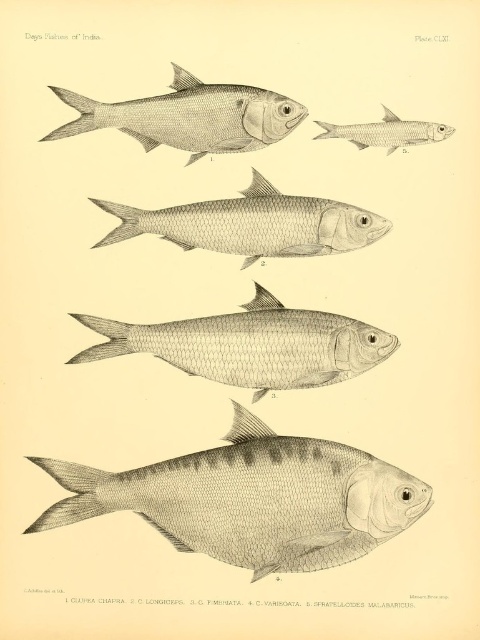
Consider the image. You are an ichthyologist examining the illustration. You need to determine which fish is taller between the grayish silver fish at upper center and the gray metallic fish at upper center. Based on the illustration, which one is taller?

The grayish silver fish at upper center is taller than the gray metallic fish at upper center according to the illustration.

In the illustration from the scientific publication, you see two fish at the upper center labeled as grayish silver fish at upper center and gray metallic fish at upper center. Which one is located to the left?

The grayish silver fish at upper center is positioned on the left side of the gray metallic fish at upper center.